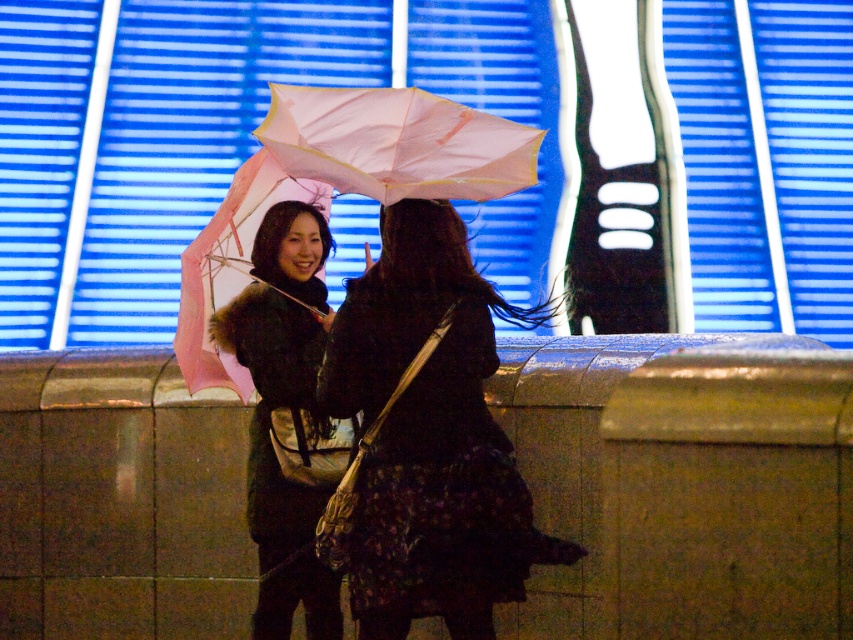
You are a photographer trying to capture a clear photo of both the matte black coat at center and the pink matte umbrella at center. Which object should you adjust your focus on first to ensure it appears sharp in the final image?

The matte black coat at center is closer to the viewer than the pink matte umbrella at center, so you should focus on the matte black coat at center first to ensure it appears sharp.

You are a photographer setting up a shot of the two people in the scene. You want to ensure the concrete ledge at center and the pink matte umbrella at left are both visible in the frame. Given their heights, which object should you position closer to the camera to avoid one blocking the other?

The concrete ledge at center is taller than the pink matte umbrella at left, so to avoid the ledge blocking the umbrella, you should position the pink matte umbrella at left closer to the camera.